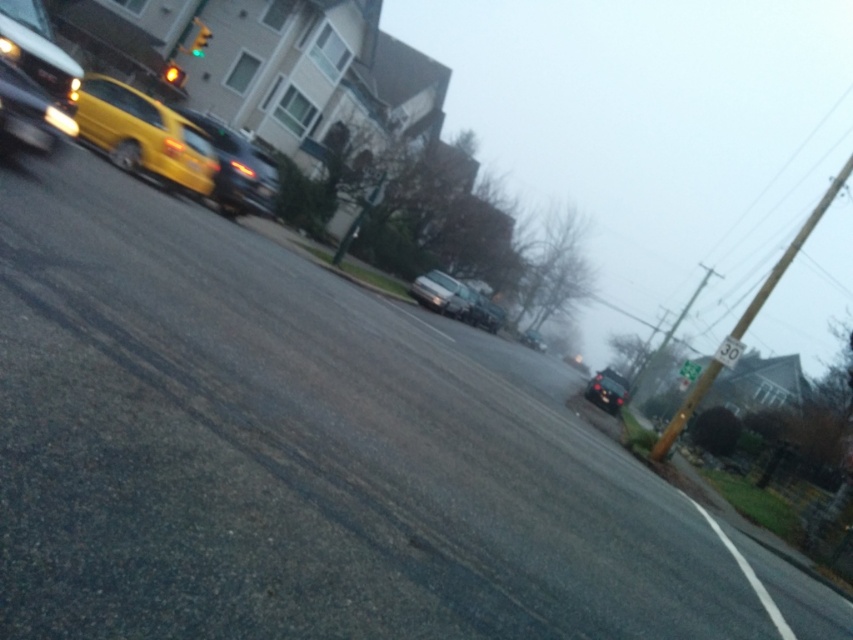
From the picture: You are a driver approaching the intersection and see the green glass traffic light at upper center and the amber glass traffic light at upper left. Which traffic light is wider?

The amber glass traffic light at upper left is wider than the green glass traffic light at upper center.

You are a pedestrian standing at the point with coordinates point (x=206, y=28) and want to walk to the point with coordinates point (x=171, y=68). Which direction should you move to reach your destination?

You should move away from the viewer because point (x=171, y=68) is further away than point (x=206, y=28).

You are a pedestrian standing at the edge of the road. You see the shiny black sedan at center and the amber glass traffic light at upper left. Which object is taller?

The shiny black sedan at center is taller than the amber glass traffic light at upper left.